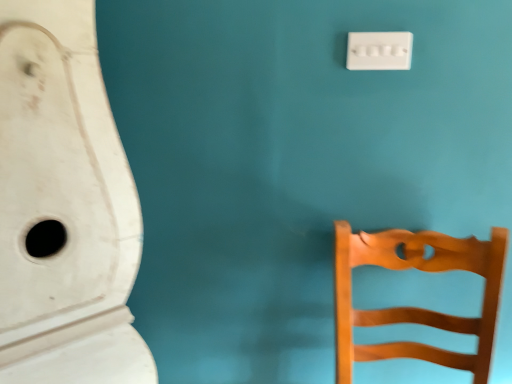
Question: From the image's perspective, is wooden chair at right located above or below white matte urinal at left?

Choices:
 (A) below
 (B) above

Answer: (A)

Question: Would you say wooden chair at right is to the left or to the right of white matte urinal at left in the picture?

Choices:
 (A) right
 (B) left

Answer: (A)

Question: Which is farther from the white matte urinal at left?

Choices:
 (A) white plastic light switch at upper right
 (B) wooden chair at right

Answer: (A)

Question: Which is nearer to the white plastic light switch at upper right?

Choices:
 (A) wooden chair at right
 (B) white matte urinal at left

Answer: (A)